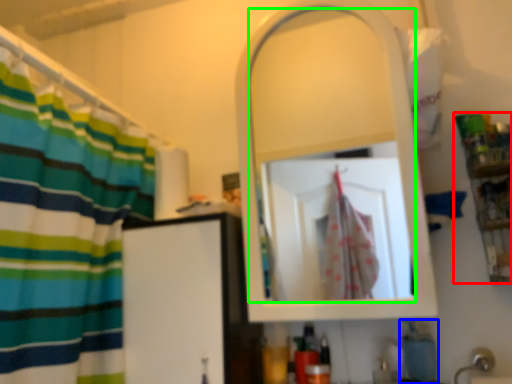
Question: Estimate the real-world distances between objects in this image. Which object is closer to shelf (highlighted by a red box), soap (highlighted by a blue box) or mirror (highlighted by a green box)?

Choices:
 (A) soap
 (B) mirror

Answer: (A)